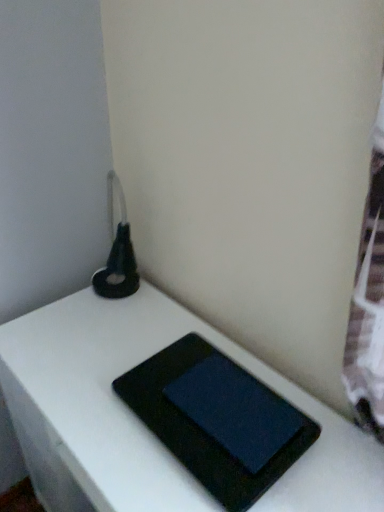
Identify the location of free space above black matte tablet at center, placed as the 1th tablet computer when sorted from bottom to top (from a real-world perspective). (208, 408).